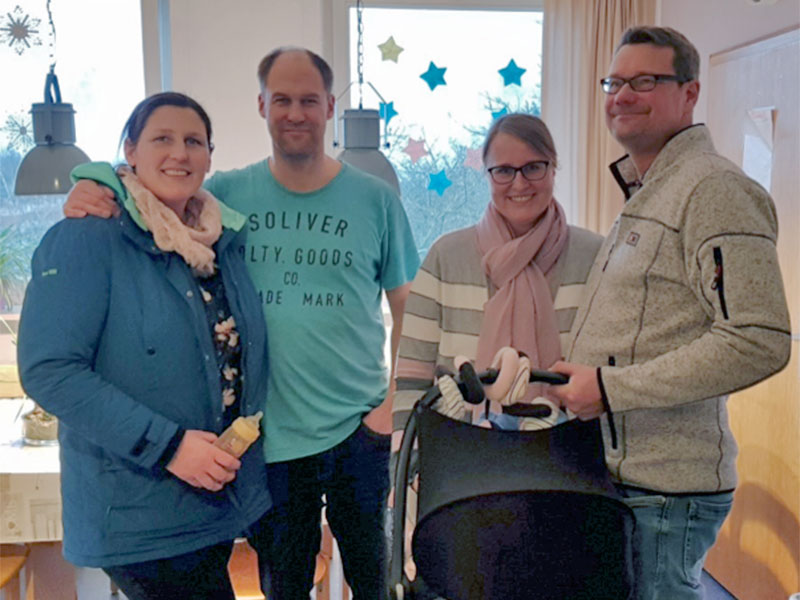
The image size is (800, 600). Find the location of `yellow star cutout on window`. yellow star cutout on window is located at coordinates (380, 48).